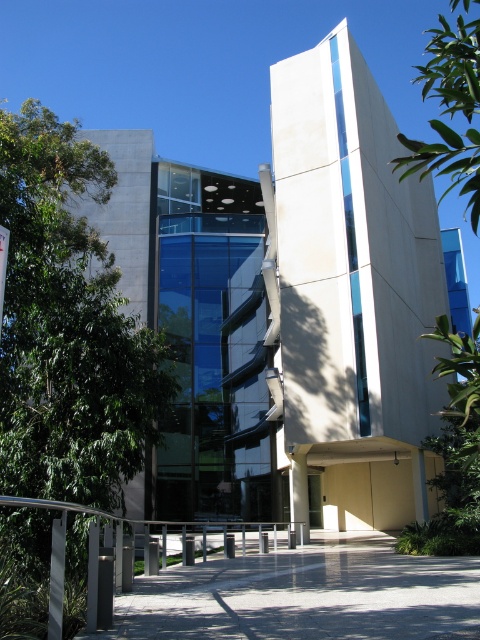
Question: Which of the following is the farthest from the observer?

Choices:
 (A) (88, 150)
 (B) (290, 538)

Answer: (A)

Question: Is green leafy tree at left to the left of green leafy tree at upper right from the viewer's perspective?

Choices:
 (A) yes
 (B) no

Answer: (A)

Question: Estimate the real-world distances between objects in this image. Which object is closer to the concrete at center?

Choices:
 (A) green leafy tree at left
 (B) glass door at center
 (C) green leafy tree at upper right
 (D) silver metallic railing at lower center

Answer: (D)

Question: Which point appears closest to the camera in this image?

Choices:
 (A) (462, 77)
 (B) (313, 490)

Answer: (A)

Question: Is concrete at center further to camera compared to silver metallic railing at lower center?

Choices:
 (A) yes
 (B) no

Answer: (A)

Question: Is green leafy tree at left bigger than silver metallic railing at lower center?

Choices:
 (A) no
 (B) yes

Answer: (A)